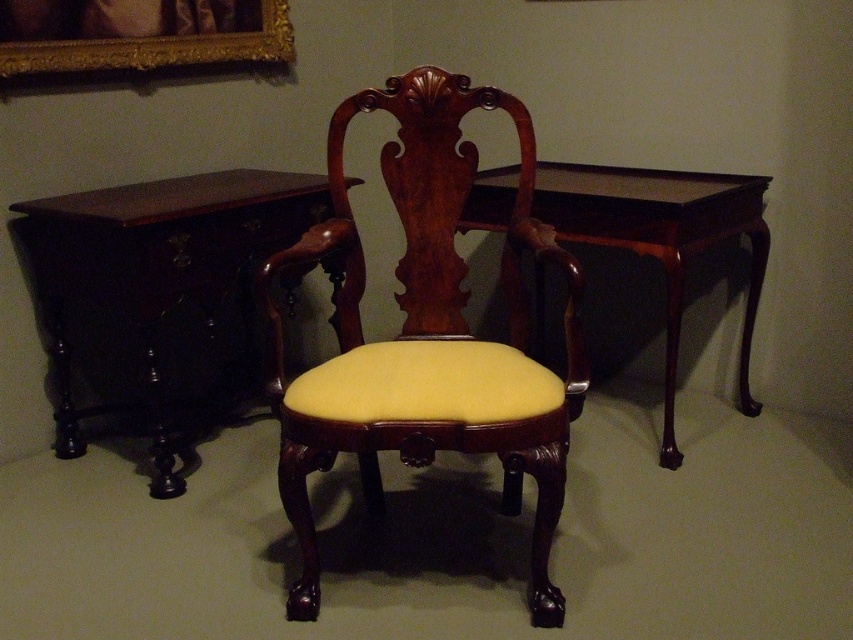
Does mahogany wood armchair at center come in front of mahogany wood table at center?

Yes, it is in front of mahogany wood table at center.

This screenshot has height=640, width=853. Identify the location of mahogany wood armchair at center. (427, 333).

Does dark wood table at left appear under mahogany wood table at center?

Yes, dark wood table at left is below mahogany wood table at center.

Can you confirm if dark wood table at left is positioned to the right of mahogany wood table at center?

No, dark wood table at left is not to the right of mahogany wood table at center.

Is point (74, 268) positioned after point (635, 188)?

No, it is in front of (635, 188).

Locate an element on the screen. This screenshot has width=853, height=640. dark wood table at left is located at coordinates (160, 298).

Is the position of dark wood table at left more distant than that of gold ornate frame at upper left?

That is False.

Who is higher up, dark wood table at left or gold ornate frame at upper left?

gold ornate frame at upper left

Is point (209, 202) behind point (39, 38)?

No, (209, 202) is in front of (39, 38).

At what (x,y) coordinates should I click in order to perform the action: click on dark wood table at left. Please return your answer as a coordinate pair (x, y). The image size is (853, 640). Looking at the image, I should click on (160, 298).